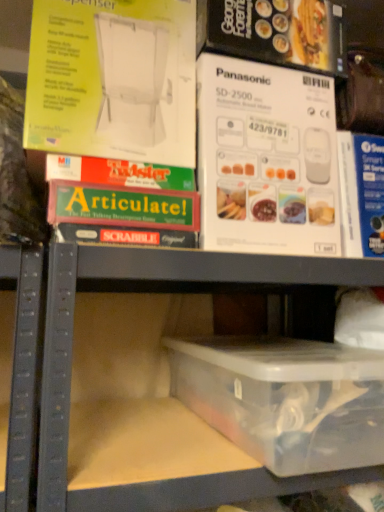
Question: From a real-world perspective, is green matte board game at upper left physically located above or below transparent plastic container at lower center?

Choices:
 (A) above
 (B) below

Answer: (A)

Question: Is green matte board game at upper left situated inside transparent plastic container at lower center or outside?

Choices:
 (A) inside
 (B) outside

Answer: (B)

Question: Which object is positioned farthest from the green matte board game at upper left?

Choices:
 (A) transparent plastic container at lower center
 (B) transparent plastic container at lower center

Answer: (B)

Question: Which is nearer to the green matte board game at upper left?

Choices:
 (A) transparent plastic container at lower center
 (B) transparent plastic container at lower center

Answer: (B)